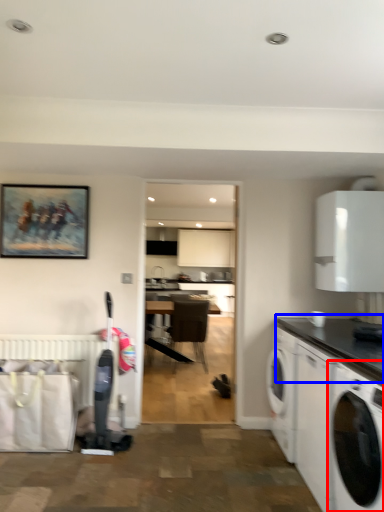
Question: Among these objects, which one is nearest to the camera, washing machine (highlighted by a red box) or countertop (highlighted by a blue box)?

Choices:
 (A) washing machine
 (B) countertop

Answer: (A)